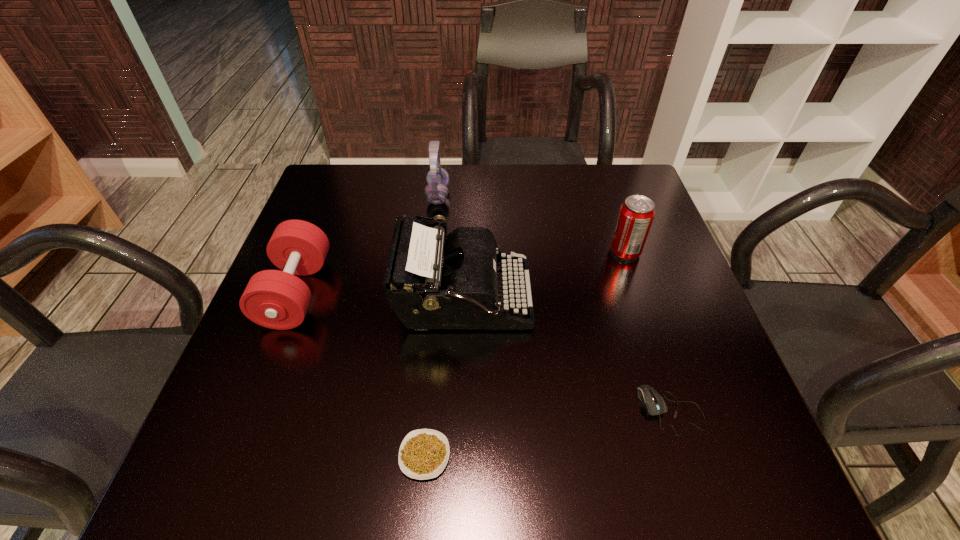
Identify the location of free space between the typewriter and the computer mouse. click(x=567, y=355).

Find the location of a particular element. free point between the shortest object and the typewriter is located at coordinates (444, 377).

This screenshot has width=960, height=540. Identify the location of vacant region between the soda and the fifth tallest object. (648, 331).

Identify the location of object that is the fifth closest to the soda. (275, 299).

This screenshot has width=960, height=540. Identify the location of object that is the third closest to the typewriter. click(436, 192).

Locate an element on the screen. blank area in the image that satisfies the following two spatial constraints: 1. on the typing side of the computer mouse; 2. on the left side of the typewriter is located at coordinates (460, 410).

The image size is (960, 540). What are the coordinates of `vacant space that satisfies the following two spatial constraints: 1. on the front side of the soda; 2. on the typing side of the typewriter` in the screenshot? It's located at (640, 299).

Locate an element on the screen. The width and height of the screenshot is (960, 540). vacant region that satisfies the following two spatial constraints: 1. on the headband and ear cups of the fifth tallest object; 2. on the right side of the farthest object is located at coordinates (414, 410).

Image resolution: width=960 pixels, height=540 pixels. Identify the location of vacant area that satisfies the following two spatial constraints: 1. on the headband and ear cups of the farthest object; 2. on the left side of the soda. (432, 252).

Where is `vacant area that satisfies the following two spatial constraints: 1. on the back side of the fifth tallest object; 2. on the headband and ear cups of the headset`? vacant area that satisfies the following two spatial constraints: 1. on the back side of the fifth tallest object; 2. on the headband and ear cups of the headset is located at coordinates coord(602,195).